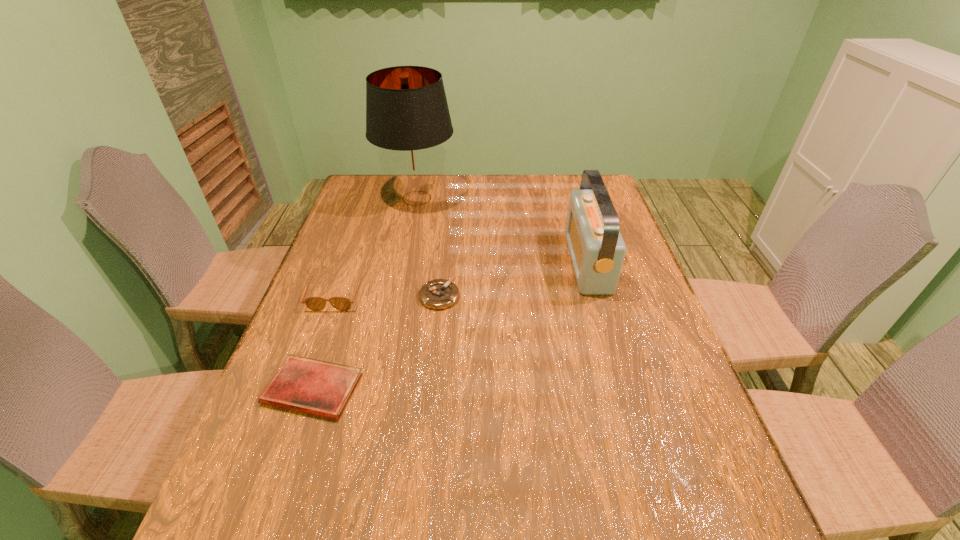
You are a GUI agent. You are given a task and a screenshot of the screen. Output one action in this format:
    pyautogui.click(x=<x>, y=<y>)
    Task: Click on the free space that satisfies the following two spatial constraints: 1. on the back side of the tallest object; 2. on the right side of the diary
    This screenshot has height=540, width=960.
    Given the screenshot: What is the action you would take?
    pyautogui.click(x=377, y=198)

Locate an element on the screen. This screenshot has width=960, height=540. free spot that satisfies the following two spatial constraints: 1. on the front-facing side of the sunglasses; 2. on the right side of the nearest object is located at coordinates (302, 389).

I want to click on vacant position in the image that satisfies the following two spatial constraints: 1. on the front-facing side of the third shortest object; 2. on the left side of the fourth tallest object, so click(x=336, y=296).

What are the coordinates of `blank area in the image that satisfies the following two spatial constraints: 1. on the front-facing side of the sunglasses; 2. on the right side of the nearest object` in the screenshot? It's located at (302, 389).